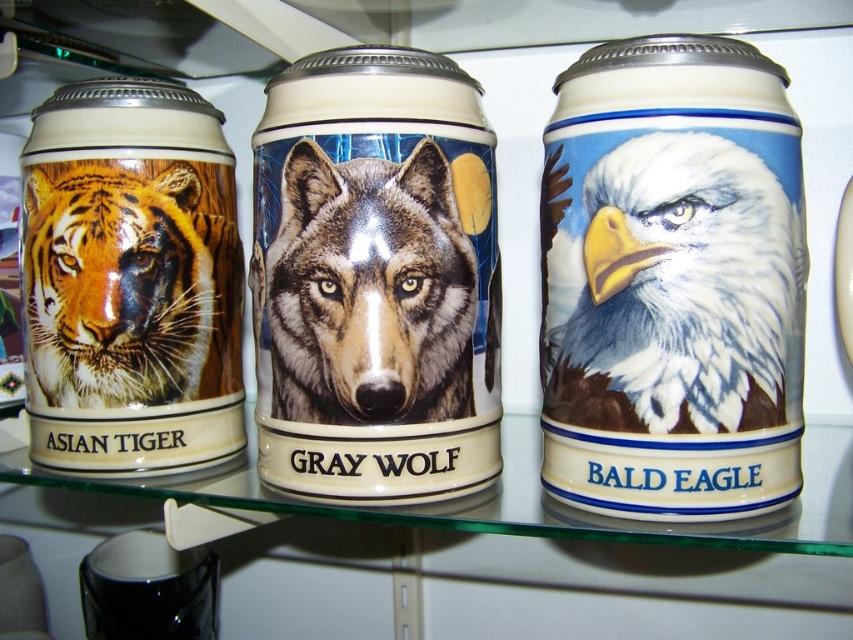
You are a photographer setting up a tripod to take a closeup shot of the glossy ceramic mug at center. The tripod has a maximum extension of 20 inches. Can you get close enough to the mug to take the photo without moving the mug?

The glossy ceramic mug at center is 20.68 inches from the camera. Since the tripod can only extend up to 20 inches, you cannot get close enough to the mug without moving it.

You are an interior designer arranging items on a shelf. You have a white glossy bald eagle at center and a glossy ceramic mug at center. According to the scene, which item is closer to the viewer?

The glossy ceramic mug at center is closer to the viewer because the white glossy bald eagle at center is positioned behind it.

You are organizing a display of animal mugs on a glass shelf. You have a new mug of a Gray Wolf with a night sky background that needs to be placed exactly at coordinates point (x=375, y=276). However, there is already a glossy ceramic mug at center at that location. Can you place the new Gray Wolf mug there without moving the existing glossy ceramic mug at center?

The glossy ceramic mug at center is already located at point (x=375, y=276), so you cannot place the new Gray Wolf mug there without moving the existing mug.